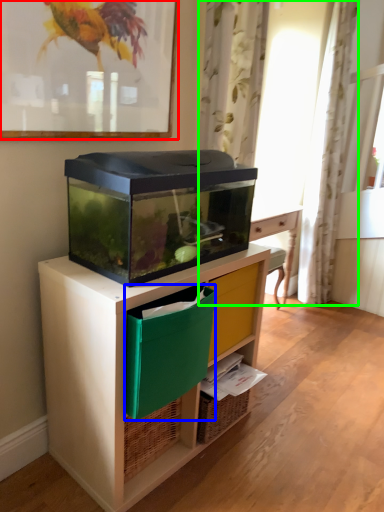
Question: Which object is positioned farthest from picture frame (highlighted by a red box)? Select from storage box (highlighted by a blue box) and curtain (highlighted by a green box).

Choices:
 (A) storage box
 (B) curtain

Answer: (B)